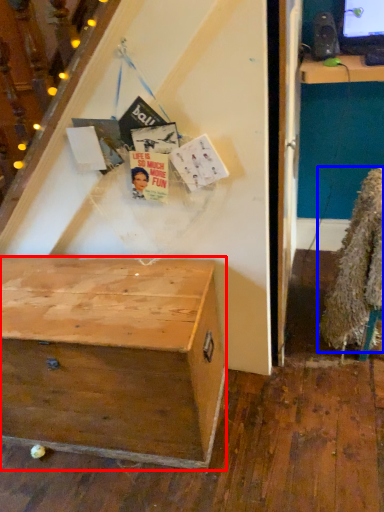
Question: Among these objects, which one is farthest to the camera, desk (highlighted by a red box) or fur coat (highlighted by a blue box)?

Choices:
 (A) desk
 (B) fur coat

Answer: (B)